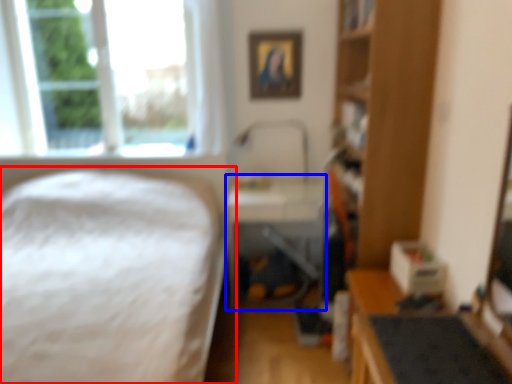
Question: Which object appears closest to the camera in this image, bed (highlighted by a red box) or table (highlighted by a blue box)?

Choices:
 (A) bed
 (B) table

Answer: (A)